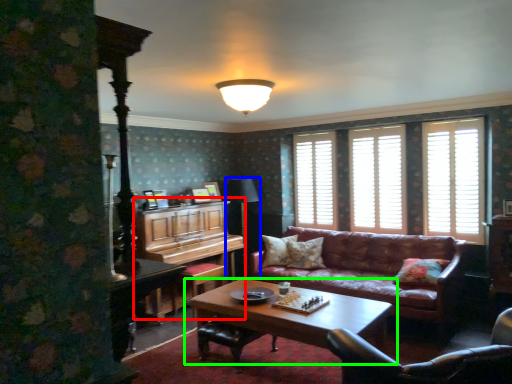
Question: Which object is the farthest from dresser (highlighted by a red box)? Choose among these: table lamp (highlighted by a blue box) or coffee table (highlighted by a green box).

Choices:
 (A) table lamp
 (B) coffee table

Answer: (B)